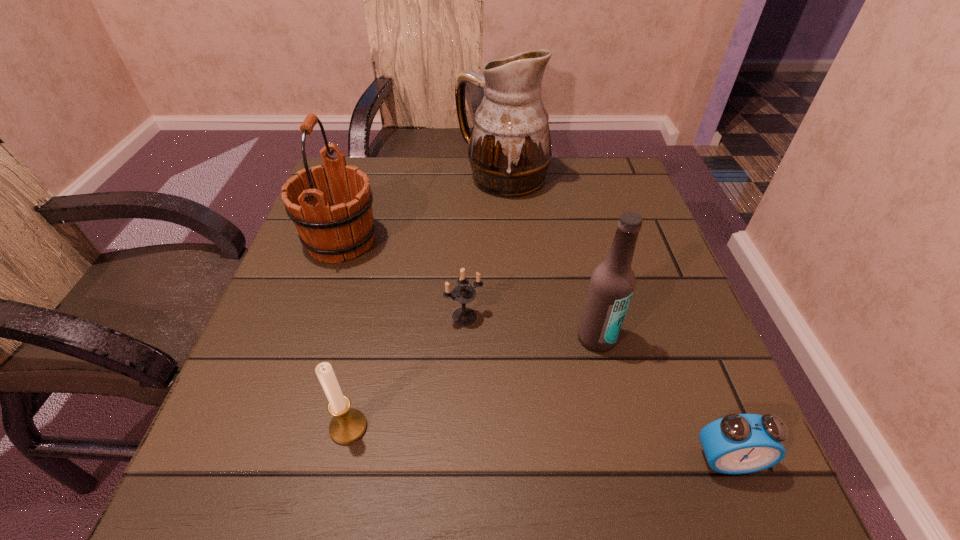
The height and width of the screenshot is (540, 960). Find the location of `pitcher`. pitcher is located at coordinates (509, 151).

The width and height of the screenshot is (960, 540). I want to click on the fifth nearest object, so click(x=330, y=232).

Where is `beer bottle`? The image size is (960, 540). beer bottle is located at coordinates (612, 283).

Locate an element on the screen. This screenshot has width=960, height=540. the taller candle holder is located at coordinates (348, 425).

The height and width of the screenshot is (540, 960). What are the coordinates of `the third shortest object` in the screenshot? It's located at (348, 425).

The image size is (960, 540). I want to click on the shorter candle holder, so click(463, 293).

The image size is (960, 540). In order to click on the farther candle holder in this screenshot , I will do `click(463, 293)`.

Find the location of a particular element. This screenshot has height=540, width=960. the rightmost object is located at coordinates (738, 443).

In order to click on free space located 0.180m from the spout of the farthest object in this screenshot , I will do click(x=389, y=178).

You are a GUI agent. You are given a task and a screenshot of the screen. Output one action in this format:
    pyautogui.click(x=<x>, y=<y>)
    Task: Click on the vacant space located from the spout of the farthest object
    Image resolution: width=960 pixels, height=540 pixels.
    Given the screenshot: What is the action you would take?
    point(393,178)